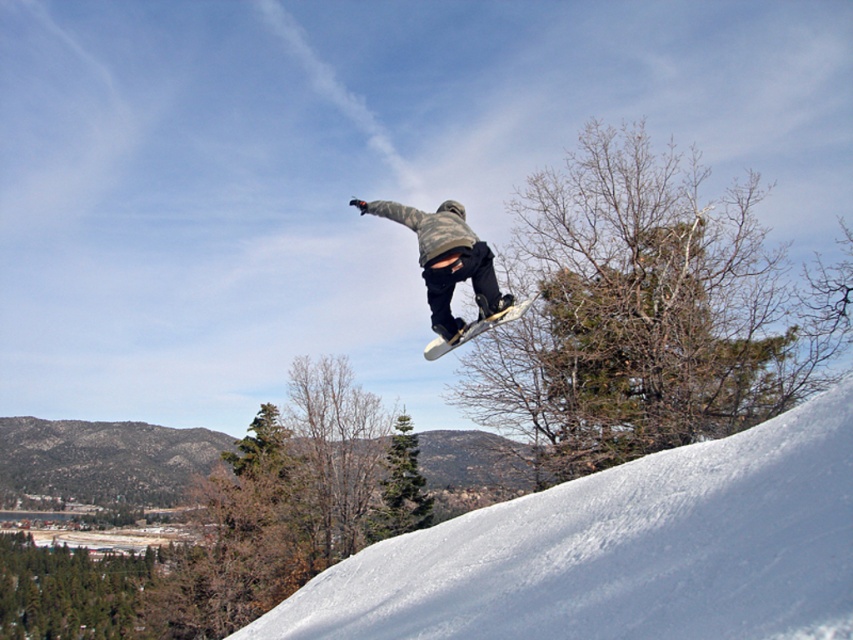
Question: Can you confirm if white snow at lower right is smaller than camouflage fabric snowboarder at center?

Choices:
 (A) no
 (B) yes

Answer: (A)

Question: Which object appears closest to the camera in this image?

Choices:
 (A) white matte snowboard at center
 (B) camouflage fabric snowboarder at center

Answer: (B)

Question: Does white snow at lower right appear under white matte snowboard at center?

Choices:
 (A) yes
 (B) no

Answer: (A)

Question: Considering the real-world distances, which object is farthest from the camouflage fabric snowboarder at center?

Choices:
 (A) white matte snowboard at center
 (B) white snow at lower right

Answer: (B)

Question: Which point is farther to the camera?

Choices:
 (A) (456, 234)
 (B) (646, 544)
 (C) (462, 337)

Answer: (C)

Question: Considering the relative positions of white snow at lower right and white matte snowboard at center in the image provided, where is white snow at lower right located with respect to white matte snowboard at center?

Choices:
 (A) right
 (B) left

Answer: (B)